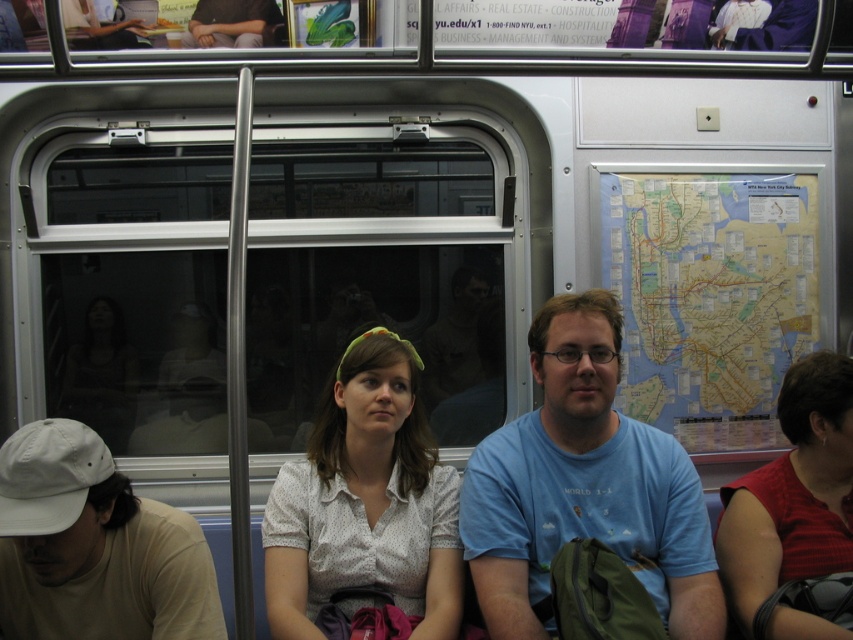
Question: Which of the following is the closest to the observer?

Choices:
 (A) (628, 339)
 (B) (207, 42)

Answer: (B)

Question: Does blue cotton t-shirt at center appear on the right side of matte red shirt at right?

Choices:
 (A) no
 (B) yes

Answer: (A)

Question: Which object appears farthest from the camera in this image?

Choices:
 (A) printed cotton blouse at center
 (B) beige cotton t-shirt at lower left
 (C) paper map at right

Answer: (C)

Question: Which point is closer to the camera?

Choices:
 (A) (606, 508)
 (B) (263, 3)
 (C) (831, 451)

Answer: (A)

Question: Can you confirm if matte red shirt at right is smaller than matte black shirt at center?

Choices:
 (A) no
 (B) yes

Answer: (A)

Question: Does beige cotton t-shirt at lower left appear under matte black shirt at center?

Choices:
 (A) no
 (B) yes

Answer: (B)